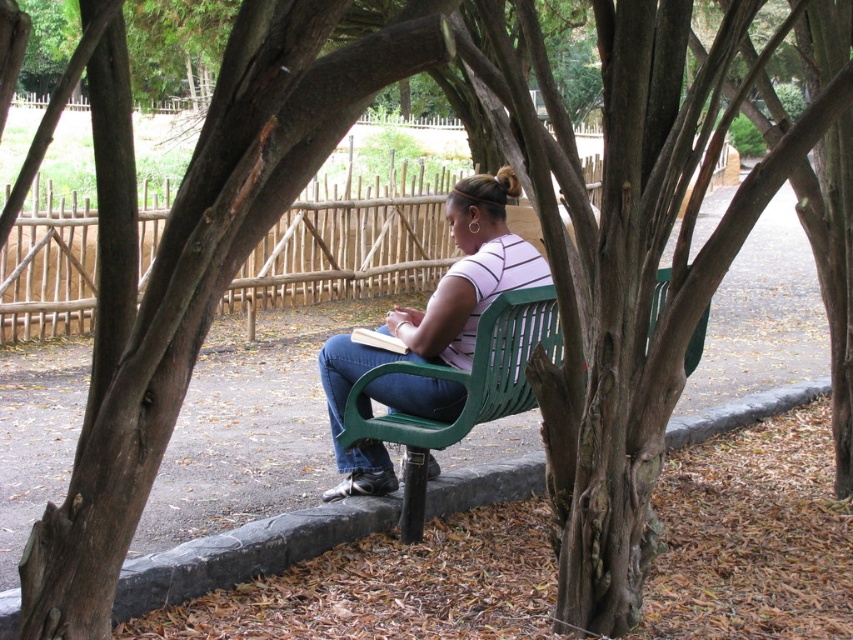
You are designing a garden layout and need to place a new flower pot between the matte green bench at center and the green plastic bench at center. Which bench should the flower pot be closer to if you want it to be equidistant from both benches?

The flower pot should be closer to the green plastic bench at center because the matte green bench at center is wider, so placing it closer to the narrower green plastic bench at center will help maintain equal distance between both benches.